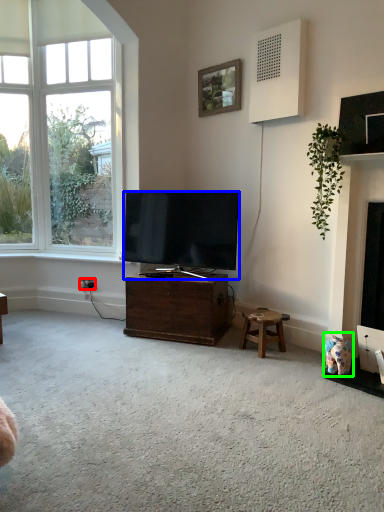
Question: Considering the real-world distances, which object is farthest from power outlet (highlighted by a red box)? television (highlighted by a blue box) or toy (highlighted by a green box)?

Choices:
 (A) television
 (B) toy

Answer: (B)